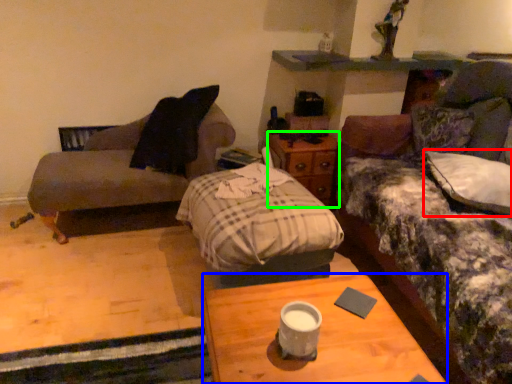
Question: Which object is the farthest from pillow (highlighted by a red box)? Choose among these: desk (highlighted by a blue box) or nightstand (highlighted by a green box).

Choices:
 (A) desk
 (B) nightstand

Answer: (A)